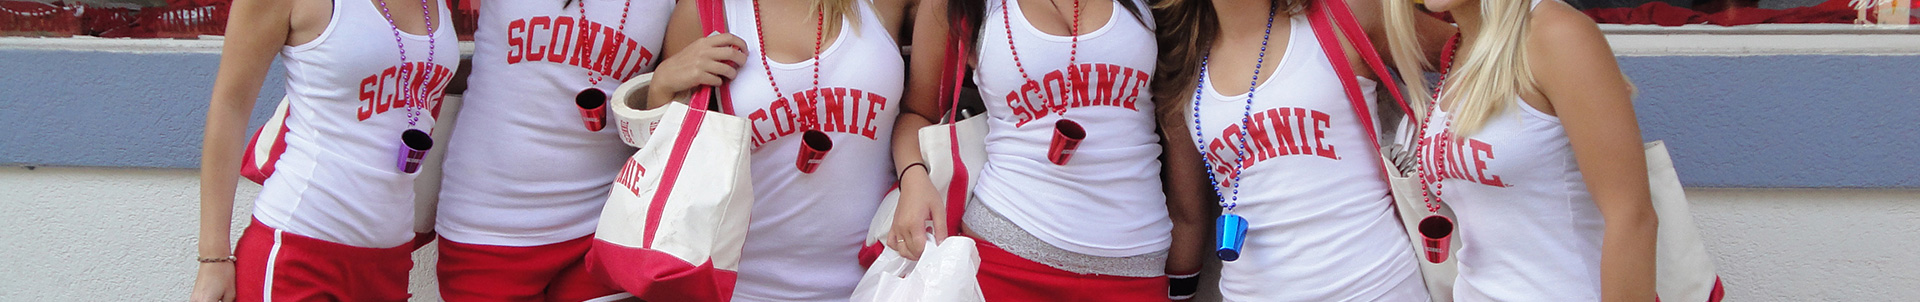
Where is `red shot glass`? red shot glass is located at coordinates (1436, 252).